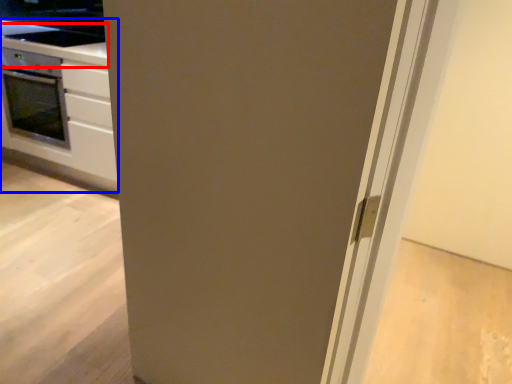
Question: Which object is further to the camera taking this photo, counter top (highlighted by a red box) or cabinetry (highlighted by a blue box)?

Choices:
 (A) counter top
 (B) cabinetry

Answer: (A)